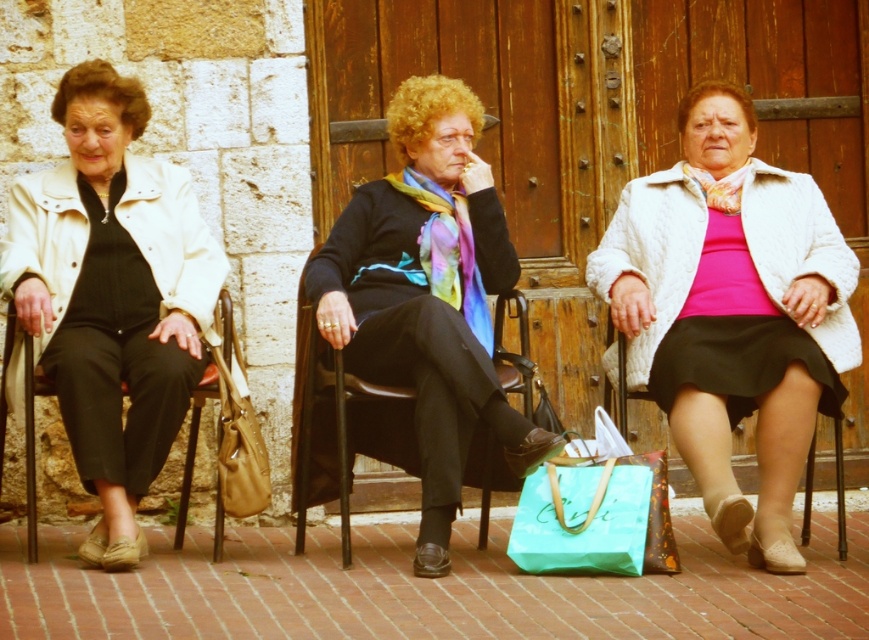
Is black leather chair at center to the left of teal fabric shopping bag at center from the viewer's perspective?

Yes, black leather chair at center is to the left of teal fabric shopping bag at center.

At what (x,y) coordinates should I click in order to perform the action: click on black leather chair at center. Please return your answer as a coordinate pair (x, y). This screenshot has height=640, width=869. Looking at the image, I should click on (340, 417).

The width and height of the screenshot is (869, 640). I want to click on black leather chair at center, so click(340, 417).

Who is more distant from viewer, (788,344) or (226,515)?

The point (226,515) is behind.

Between white textured coat at center and leather handbag at lower left, which one is positioned lower?

Positioned lower is leather handbag at lower left.

Is point (851, 320) closer to camera compared to point (243, 508)?

No, (851, 320) is further to viewer.

You are a GUI agent. You are given a task and a screenshot of the screen. Output one action in this format:
    pyautogui.click(x=<x>, y=<y>)
    Task: Click on the white textured coat at center
    This screenshot has height=640, width=869.
    Given the screenshot: What is the action you would take?
    pyautogui.click(x=732, y=310)

Does teal fabric shopping bag at center have a lesser width compared to metallic brown chair at left?

In fact, teal fabric shopping bag at center might be wider than metallic brown chair at left.

Is teal fabric shopping bag at center above metallic brown chair at left?

No.

Is point (629, 563) positioned in front of point (184, 465)?

Yes, point (629, 563) is closer to viewer.

Find the location of a particular element. The image size is (869, 640). teal fabric shopping bag at center is located at coordinates (x=596, y=515).